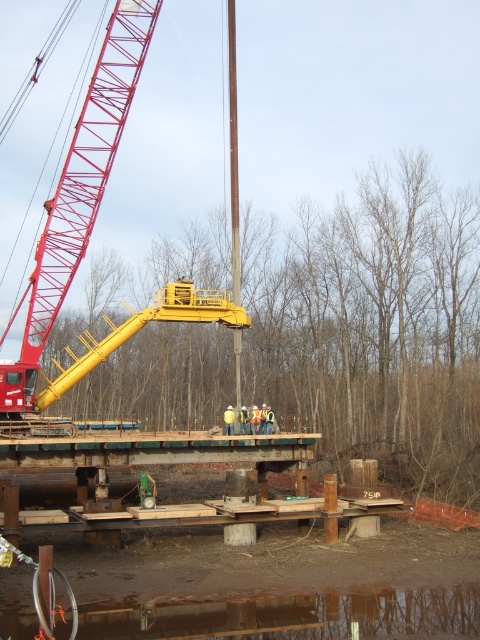
Between point (15, 392) and point (303, 614), which one is positioned behind?

Positioned behind is point (15, 392).

Between red metal crane at upper left and brown reflective water at lower center, which one has more height?

red metal crane at upper left is taller.

Does point (118, 52) lie in front of point (404, 634)?

No, (118, 52) is further to viewer.

The height and width of the screenshot is (640, 480). What are the coordinates of `red metal crane at upper left` in the screenshot? It's located at (78, 196).